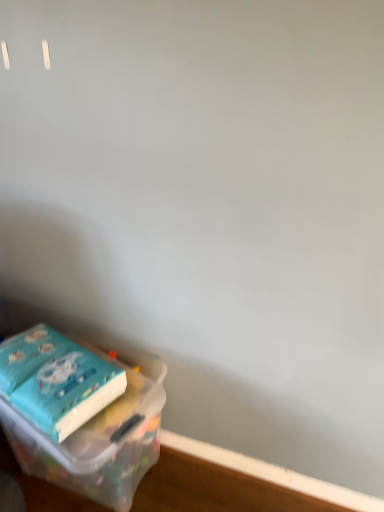
Find the location of a particular element. free space above teal matte paper at lower left (from a real-world perspective) is located at coordinates (41, 357).